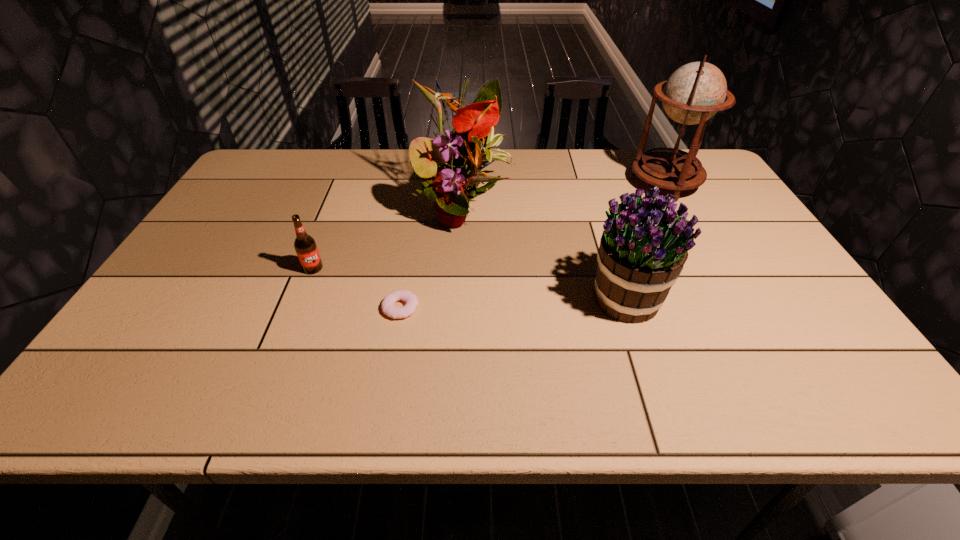
The image size is (960, 540). In order to click on vacant region located on the surface of the globe in this screenshot , I will do `click(562, 183)`.

The width and height of the screenshot is (960, 540). In order to click on vacant region located 0.210m on the front-facing side of the left bouquet in this screenshot , I will do `click(458, 303)`.

In order to click on vacant region located 0.260m on the right of the right bouquet in this screenshot , I will do `click(773, 299)`.

This screenshot has width=960, height=540. What are the coordinates of `vacant space located 0.110m on the right of the root beer` in the screenshot? It's located at (366, 268).

Find the location of a particular element. This screenshot has width=960, height=540. vacant space located on the back of the shortest object is located at coordinates (416, 222).

What are the coordinates of `globe that is at the far edge` in the screenshot? It's located at (695, 92).

Identify the location of bouquet at the far edge. (461, 156).

In order to click on object present at the right edge in this screenshot , I will do `click(695, 92)`.

Find the location of a particular element. object at the far right corner is located at coordinates point(695,92).

Image resolution: width=960 pixels, height=540 pixels. In the image, there is a desktop. In order to click on vacant space at the far edge in this screenshot , I will do `click(329, 158)`.